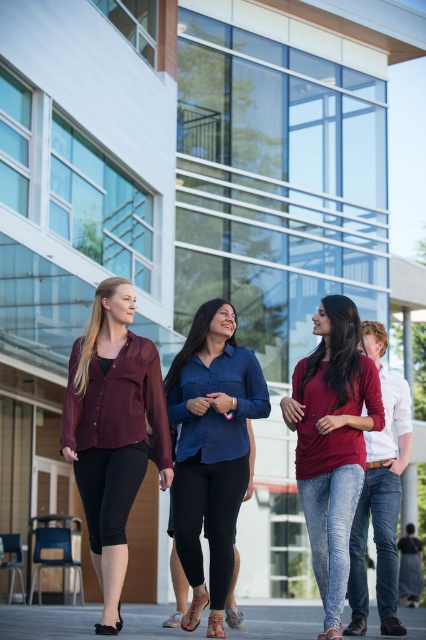
Question: Does navy blue shirt at center have a larger size compared to matte red shirt at center?

Choices:
 (A) no
 (B) yes

Answer: (A)

Question: Which point appears closest to the camera in this image?

Choices:
 (A) (380, 400)
 (B) (261, 410)
 (C) (388, 531)
 (D) (104, 512)

Answer: (D)

Question: Which object appears farthest from the camera in this image?

Choices:
 (A) jeans at center
 (B) matte red shirt at center
 (C) navy blue shirt at center

Answer: (A)

Question: Does matte burgundy blouse at center appear on the right side of navy blue shirt at center?

Choices:
 (A) yes
 (B) no

Answer: (B)

Question: Which object appears closest to the camera in this image?

Choices:
 (A) matte burgundy blouse at center
 (B) navy blue shirt at center
 (C) matte red shirt at center

Answer: (C)

Question: Is matte red shirt at center to the right of jeans at center from the viewer's perspective?

Choices:
 (A) yes
 (B) no

Answer: (B)